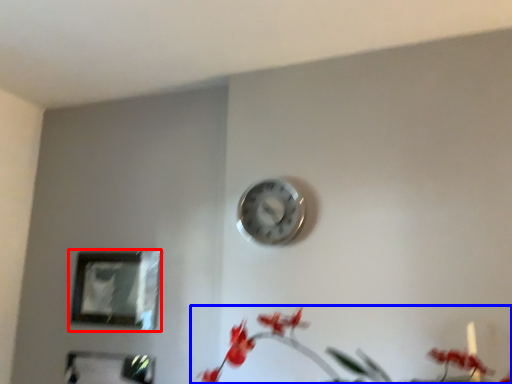
Question: Which object appears farthest to the camera in this image, picture frame (highlighted by a red box) or floral arrangement (highlighted by a blue box)?

Choices:
 (A) picture frame
 (B) floral arrangement

Answer: (A)